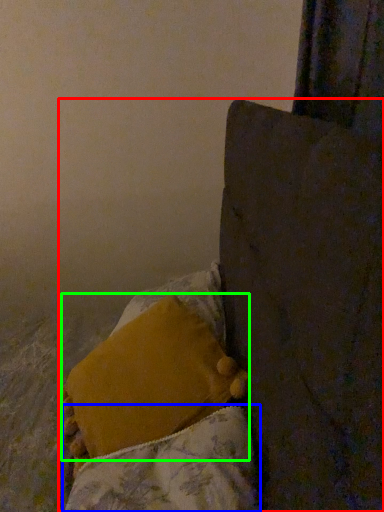
Question: Which is farther away from furniture (highlighted by a red box)? blanket (highlighted by a blue box) or pillow (highlighted by a green box)?

Choices:
 (A) blanket
 (B) pillow

Answer: (B)